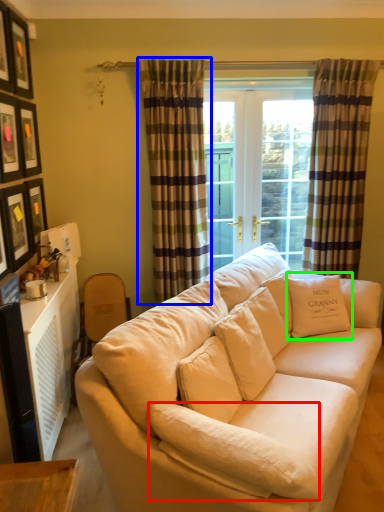
Question: Estimate the real-world distances between objects in this image. Which object is farther from pillow (highlighted by a red box), curtain (highlighted by a blue box) or pillow (highlighted by a green box)?

Choices:
 (A) curtain
 (B) pillow

Answer: (A)